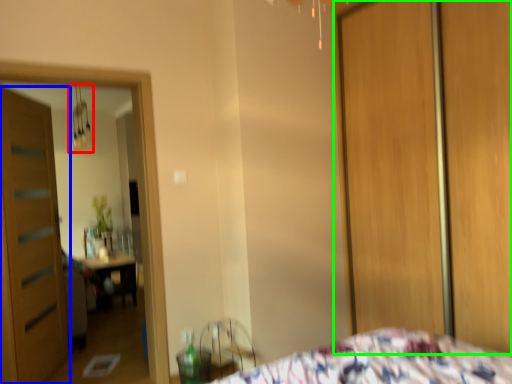
Question: Which object is the closest to the light fixture (highlighted by a red box)? Choose among these: door (highlighted by a blue box) or screen door (highlighted by a green box).

Choices:
 (A) door
 (B) screen door

Answer: (A)